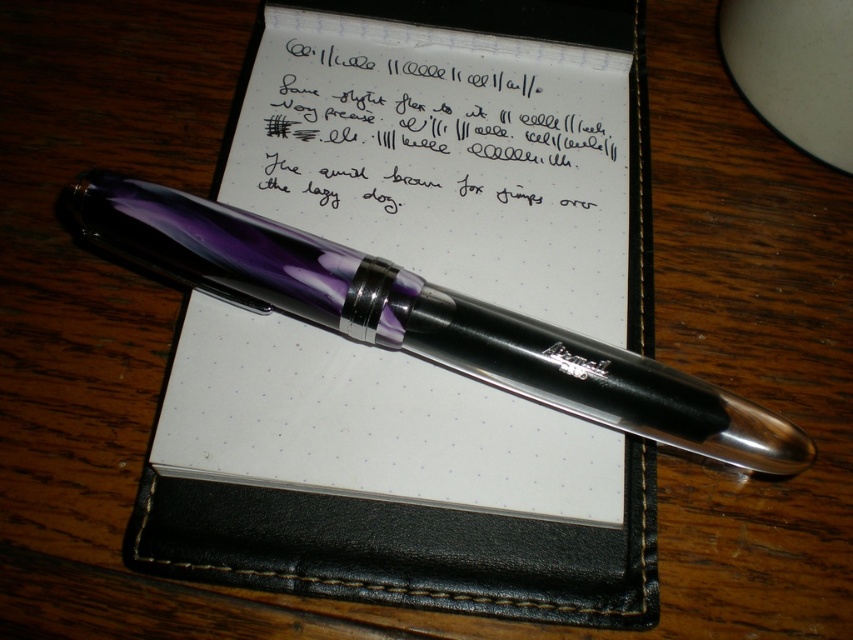
You are organizing a desk and need to place a new item between the black leather notebook at center and the black paper at center. Since both items are at the center, how can you position the new item so it is between them?

The black leather notebook at center is in front of the black paper at center, so you can place the new item between them by positioning it behind the black leather notebook at center but in front of the black paper at center.

You have a small notepad and a fountain pen on your desk. You want to place a new sticker that is 10 cm wide on the desk without covering either object. Given the sizes of the black paper at center and translucent purple pen at center, can you fit the sticker next to them?

The black paper at center is narrower than the translucent purple pen at center. Since the sticker is 10 cm wide, you need to ensure there is enough space on the desk not occupied by either object. However, without knowing the exact dimensions of the desk or the positions of the objects, it is impossible to determine if the sticker will fit. Consider measuring the available space between or around the objects to confirm.